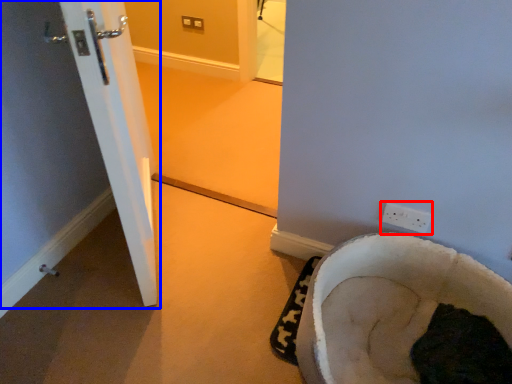
Question: Which of the following is the farthest to the observer, electric outlet (highlighted by a red box) or door (highlighted by a blue box)?

Choices:
 (A) electric outlet
 (B) door

Answer: (B)